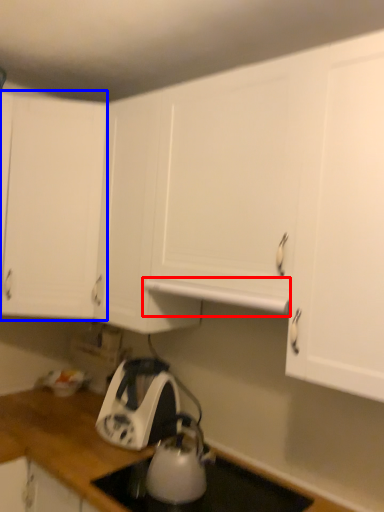
Question: Among these objects, which one is farthest to the camera, exhaust hood (highlighted by a red box) or cabinetry (highlighted by a blue box)?

Choices:
 (A) exhaust hood
 (B) cabinetry

Answer: (B)